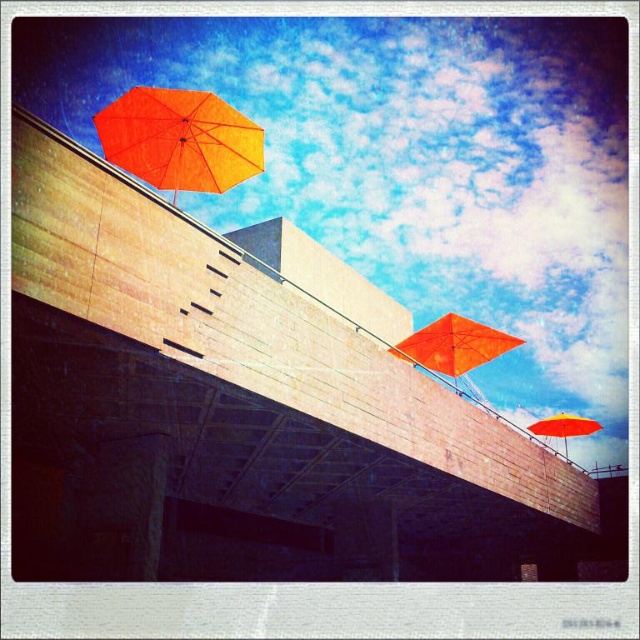
Question: Estimate the real-world distances between objects in this image. Which object is farther from the orange matte umbrella at upper left?

Choices:
 (A) orange matte umbrella at upper right
 (B) orange matte umbrella at center

Answer: (A)

Question: Is orange matte umbrella at upper left further to the viewer compared to orange matte umbrella at upper right?

Choices:
 (A) no
 (B) yes

Answer: (A)

Question: Is orange matte umbrella at center closer to camera compared to orange matte umbrella at upper right?

Choices:
 (A) no
 (B) yes

Answer: (B)

Question: Which of these objects is positioned closest to the orange matte umbrella at upper left?

Choices:
 (A) orange matte umbrella at center
 (B) orange matte umbrella at upper right

Answer: (A)

Question: Can you confirm if orange matte umbrella at upper left is smaller than orange matte umbrella at upper right?

Choices:
 (A) no
 (B) yes

Answer: (B)

Question: Which object appears farthest from the camera in this image?

Choices:
 (A) orange matte umbrella at upper left
 (B) orange matte umbrella at upper right

Answer: (B)